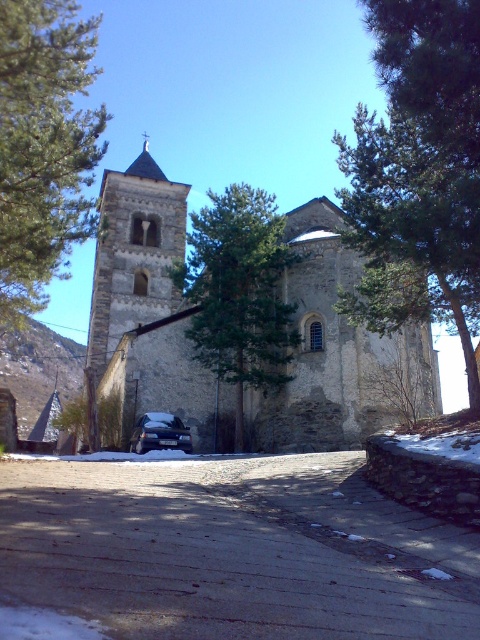
Looking at this image, you are standing at the base of the historic stone church and looking towards the bell tower. There is a point marked at coordinates (44, 147). What object is located at that point?

The point at coordinates (44, 147) indicates a green leafy tree at the left.

You are a hiker planning to take a photo of the stone tower at center and the green leafy tree at left from the road. Which object will appear smaller in your photo?

The green leafy tree at left will appear smaller in the photo because it occupies less space than the stone tower at center.

You are a tourist standing at the base of the paved road leading to the stone church at center. You notice the stone tower at center nearby. Which structure should you approach first if you want to visit the larger building?

You should approach the stone church at center first because it is larger than the stone tower at center according to the description.